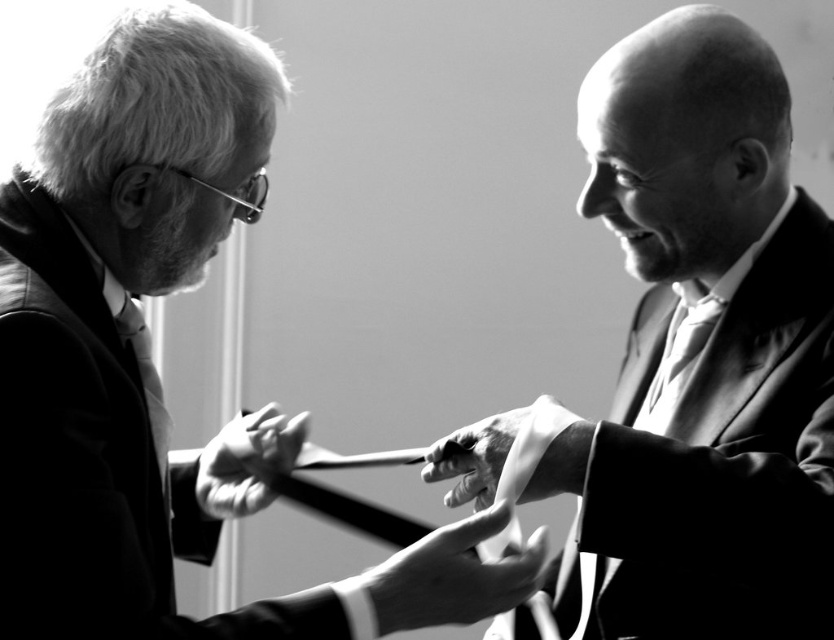
Does smooth silk tie at right have a lesser width compared to smooth fabric tie at center?

Correct, smooth silk tie at right's width is less than smooth fabric tie at center's.

From the picture: Is smooth silk tie at right wider than smooth fabric tie at center?

No.

You are a GUI agent. You are given a task and a screenshot of the screen. Output one action in this format:
    pyautogui.click(x=<x>, y=<y>)
    Task: Click on the smooth silk tie at right
    Image resolution: width=834 pixels, height=640 pixels.
    Given the screenshot: What is the action you would take?
    pyautogui.click(x=702, y=355)

Is smooth silk tie at right bigger than silky white tie at center?

Yes.

Is point (806, 285) less distant than point (687, 332)?

Yes, point (806, 285) is in front of point (687, 332).

Where is `smooth silk tie at right`? The width and height of the screenshot is (834, 640). smooth silk tie at right is located at coordinates (702, 355).

Between matte black suit at left and matte black tie at left, which one is positioned higher?

Positioned higher is matte black tie at left.

Describe the element at coordinates (98, 464) in the screenshot. The height and width of the screenshot is (640, 834). I see `matte black suit at left` at that location.

Where is `matte black suit at left`? The width and height of the screenshot is (834, 640). matte black suit at left is located at coordinates (98, 464).